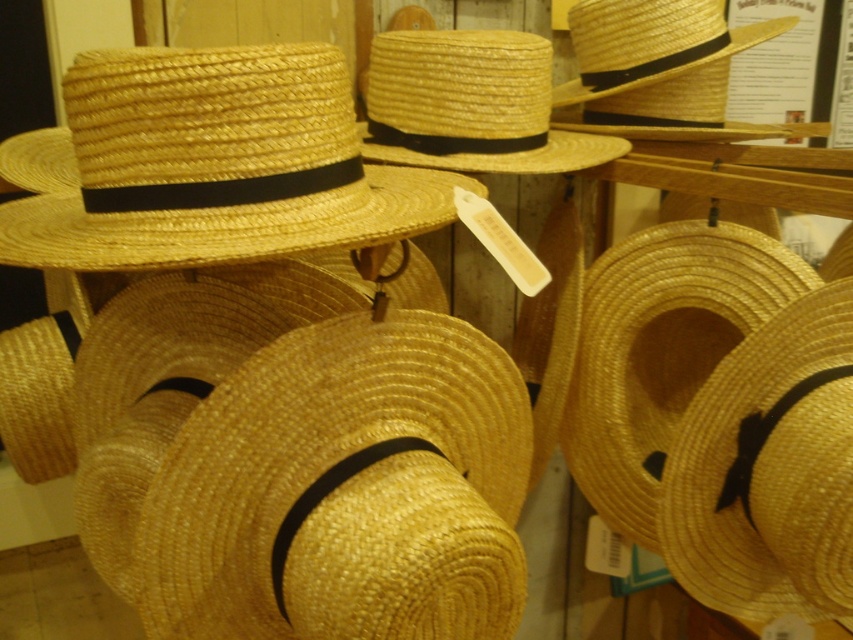
You are a customer in a hat store and want to pick up the woven straw hat at center and the natural straw cowboy hat at center. Which one do you need to move first to access the other?

The woven straw hat at center is in front of the natural straw cowboy hat at center, so you need to move the woven straw hat at center first to access the natural straw cowboy hat at center.

You are a customer in a hat shop and want to choose between the woven straw hat at center and the natural straw cowboy hat at upper left. Which hat is taller?

The woven straw hat at center is much taller than the natural straw cowboy hat at upper left.